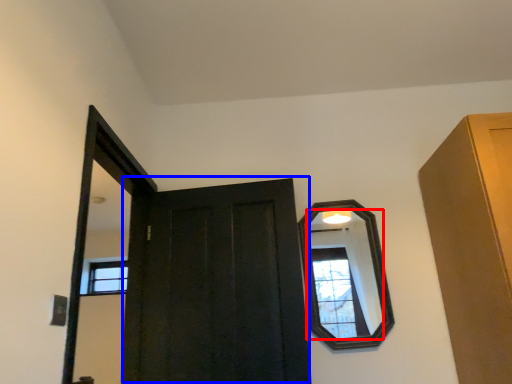
Question: Which object is further to the camera taking this photo, mirror (highlighted by a red box) or door (highlighted by a blue box)?

Choices:
 (A) mirror
 (B) door

Answer: (A)